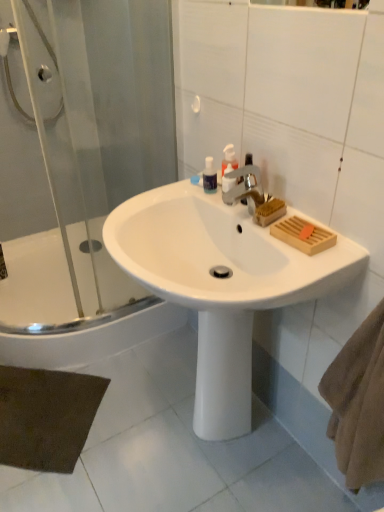
At what (x,y) coordinates should I click in order to perform the action: click on free spot below brown felt bath mat at lower left (from a real-world perspective). Please return your answer as a coordinate pair (x, y). This screenshot has width=384, height=512. Looking at the image, I should click on (35, 419).